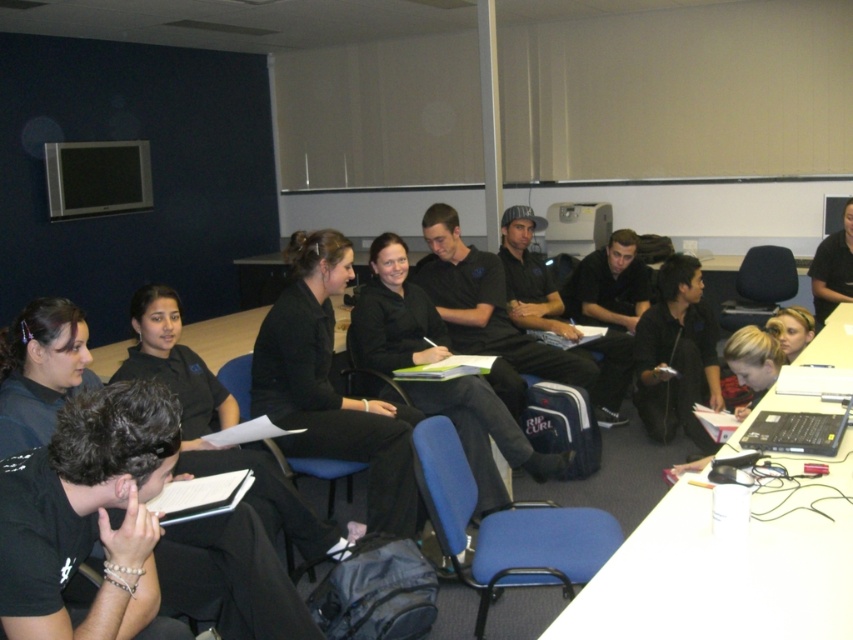
Can you confirm if black matte/black fabric pants at center is bigger than black matte/black uniform at center?

Incorrect, black matte/black fabric pants at center is not larger than black matte/black uniform at center.

Which is more to the right, black matte/black fabric pants at center or black matte/black uniform at center?

Positioned to the right is black matte/black uniform at center.

Does point (293, 337) lie in front of point (480, 385)?

That is True.

Image resolution: width=853 pixels, height=640 pixels. In order to click on black matte/black fabric pants at center in this screenshot , I will do click(x=329, y=385).

Can you confirm if black matte/black uniform at center is bigger than black matte laptop at lower right?

Yes, black matte/black uniform at center is bigger than black matte laptop at lower right.

Between point (440, 337) and point (816, 444), which one is positioned in front?

Point (816, 444) is more forward.

The width and height of the screenshot is (853, 640). What are the coordinates of `black matte/black uniform at center` in the screenshot? It's located at (393, 316).

You are a GUI agent. You are given a task and a screenshot of the screen. Output one action in this format:
    pyautogui.click(x=<x>, y=<y>)
    Task: Click on the black matte/black uniform at center
    This screenshot has height=640, width=853.
    Given the screenshot: What is the action you would take?
    pyautogui.click(x=393, y=316)

Consider the image. Does black matte/black fabric pants at center appear under black matte laptop at lower right?

No, black matte/black fabric pants at center is not below black matte laptop at lower right.

Does black matte/black fabric pants at center come behind black matte laptop at lower right?

Yes.

Image resolution: width=853 pixels, height=640 pixels. I want to click on black matte/black fabric pants at center, so click(329, 385).